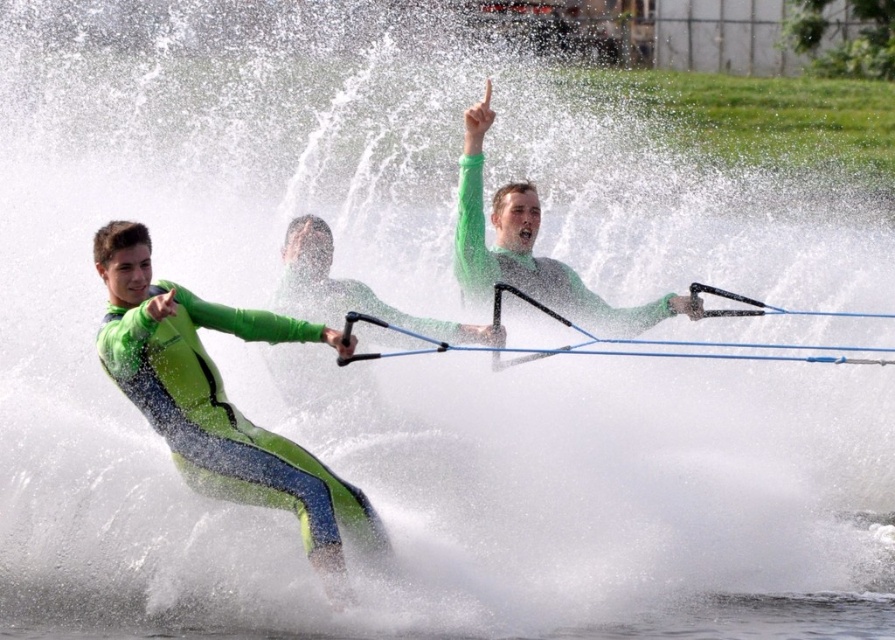
In order to click on green neoprene wetsuit at left in this screenshot , I will do pos(220,401).

Between green neoprene wetsuit at left and green matte wetsuit at center, which one is positioned higher?

Positioned higher is green matte wetsuit at center.

Locate an element on the screen. green neoprene wetsuit at left is located at coordinates (220, 401).